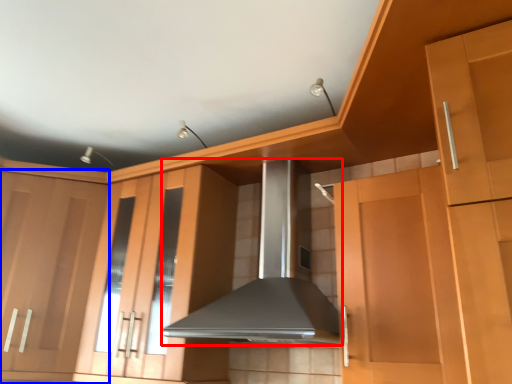
Question: Among these objects, which one is nearest to the camera, home appliance (highlighted by a red box) or cabinetry (highlighted by a blue box)?

Choices:
 (A) home appliance
 (B) cabinetry

Answer: (A)